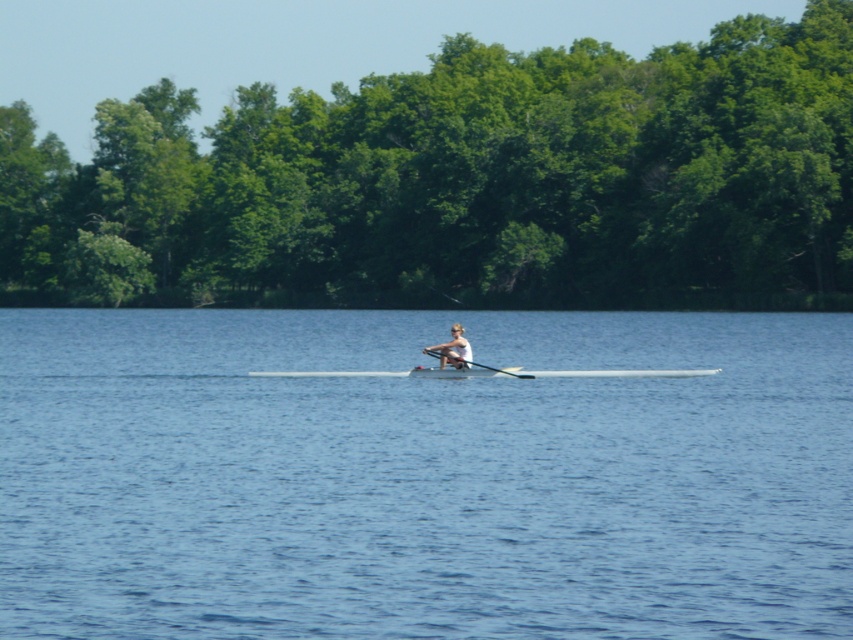
The height and width of the screenshot is (640, 853). Describe the element at coordinates (422, 476) in the screenshot. I see `blue water at center` at that location.

Which is more to the right, blue water at center or black wood paddle at center?

From the viewer's perspective, blue water at center appears more on the right side.

Which is in front, point (772, 458) or point (506, 371)?

Point (772, 458) is more forward.

Where is `blue water at center`? The height and width of the screenshot is (640, 853). blue water at center is located at coordinates (422, 476).

Which is behind, point (844, 228) or point (505, 371)?

Positioned behind is point (844, 228).

From the picture: Which is below, green leafy trees at center or black wood paddle at center?

black wood paddle at center is below.

I want to click on green leafy trees at center, so click(x=463, y=182).

Is point (136, 611) more distant than point (387, 136)?

That is False.

Which is in front, point (164, 616) or point (404, 77)?

Point (164, 616) is in front.

Find the location of a particular element. blue water at center is located at coordinates (422, 476).

The image size is (853, 640). What are the coordinates of `blue water at center` in the screenshot? It's located at (422, 476).